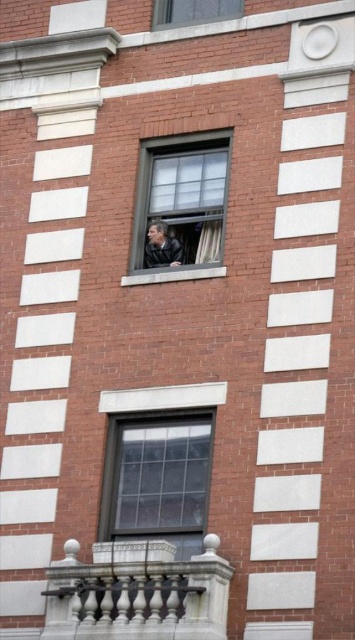
Is white marble railing at lower center positioned in front of clear glass window at upper center?

Yes, it is.

Is white marble railing at lower center shorter than clear glass window at upper center?

Yes.

Does point (127, 637) lie in front of point (199, 16)?

Yes, it is.

Find the location of `white marble railing at lower center`. white marble railing at lower center is located at coordinates (138, 593).

Which is below, clear glass window at lower center or clear glass window at center?

clear glass window at lower center is below.

Is clear glass window at lower center positioned in front of clear glass window at center?

Yes, it is in front of clear glass window at center.

Locate an element on the screen. This screenshot has height=640, width=355. clear glass window at lower center is located at coordinates (156, 477).

Is dark gray leather jacket at center bigger than white sheer curtain at center?

Actually, dark gray leather jacket at center might be smaller than white sheer curtain at center.

Is dark gray leather jacket at center positioned before white sheer curtain at center?

No, dark gray leather jacket at center is further to the viewer.

Describe the element at coordinates (161, 246) in the screenshot. I see `dark gray leather jacket at center` at that location.

Locate an element on the screen. The height and width of the screenshot is (640, 355). dark gray leather jacket at center is located at coordinates (161, 246).